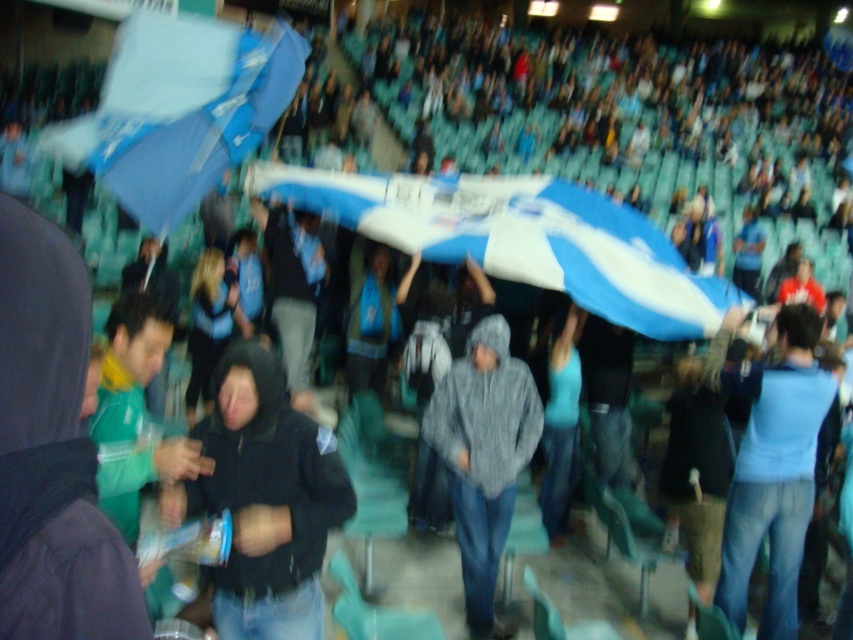
Measure the distance between black matte hoodie at center and camera.

black matte hoodie at center and camera are 2.81 meters apart from each other.

The width and height of the screenshot is (853, 640). I want to click on black matte hoodie at center, so click(264, 499).